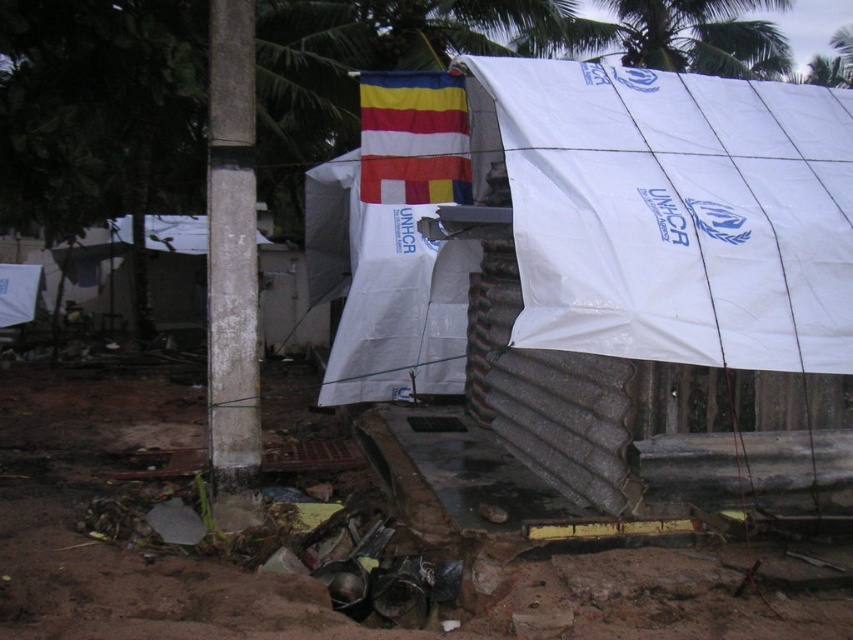
You are a photographer planning to take a photo of the shelter. You want to ensure both the white concrete pole at center and the striped fabric flag at upper center are clearly visible in the frame. Based on their sizes, which object should you focus on to ensure both are in focus?

The white concrete pole at center is much taller than the striped fabric flag at upper center, so focusing on the pole will help ensure both are in focus as it is larger and more prominent in the scene.

You are a delivery person needing to park your 2.5 meter long cart between the white plastic tent at upper center and the white concrete pole at center. Can you fit your cart there?

The distance between the white plastic tent at upper center and the white concrete pole at center is 2.91 meters, so yes, the cart can fit as it is shorter than the available space.

You are a humanitarian worker planning to place a heavy supply box on the ground near the shelter. Considering the brown dirt at lower left and the white concrete pole at center, which location would provide a more stable base for the supply box?

The brown dirt at lower left is not as tall as the white concrete pole at center, so placing the supply box on the brown dirt at lower left would be more stable since it is lower and likely flatter.